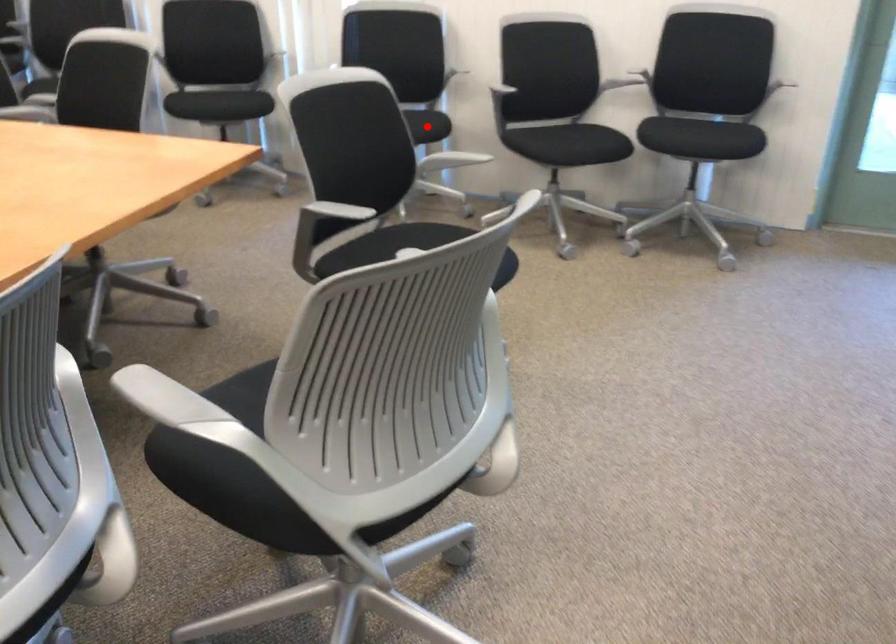
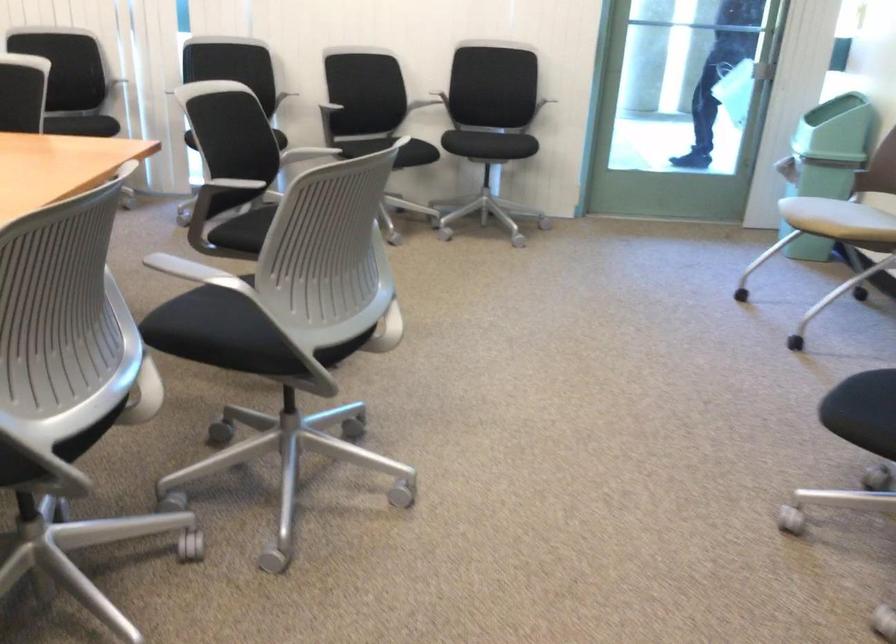
Question: I am providing you with two images of the same scene from different viewpoints. A red point is marked on the first image. Is the red point's position out of view in image 2?

Choices:
 (A) Yes
 (B) No

Answer: (A)